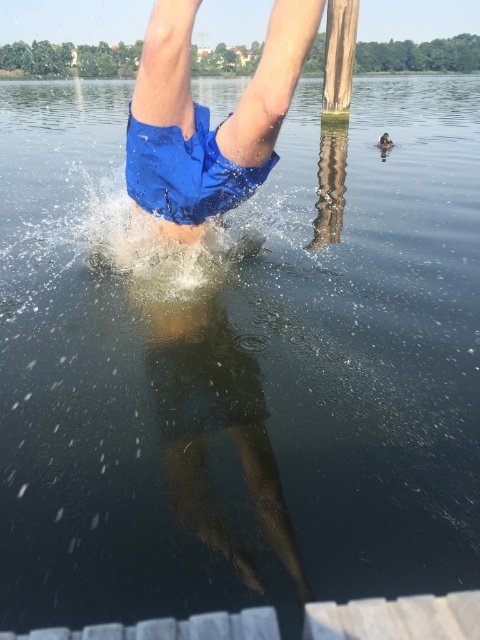
Is point (168, 132) less distant than point (343, 42)?

Yes.

Is blue fabric shorts at center behind green wood pole at upper center?

No, it is in front of green wood pole at upper center.

Describe the element at coordinates (206, 120) in the screenshot. I see `blue fabric shorts at center` at that location.

Find the location of `blue fabric shorts at center`. blue fabric shorts at center is located at coordinates (206, 120).